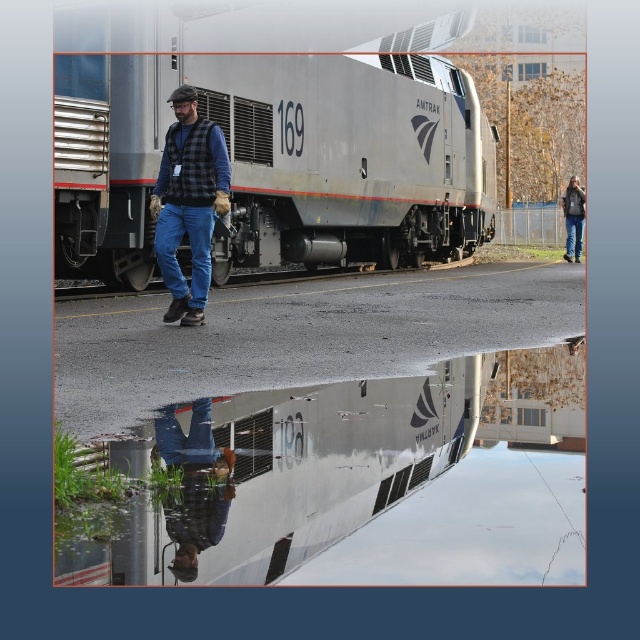
You are standing at the train station and see the point marked at coordinates (269, 148). Based on the scene description, what object is located at that point?

The point at coordinates (269, 148) is located on the brushed metal train at center.

You are a photographer trying to capture the brushed metal train at center and the denim jacket at upper right in the same frame. Based on their positions, can you tell which object is higher in the image?

The brushed metal train at center is located above the denim jacket at upper right, so the brushed metal train at center appears higher in the image.